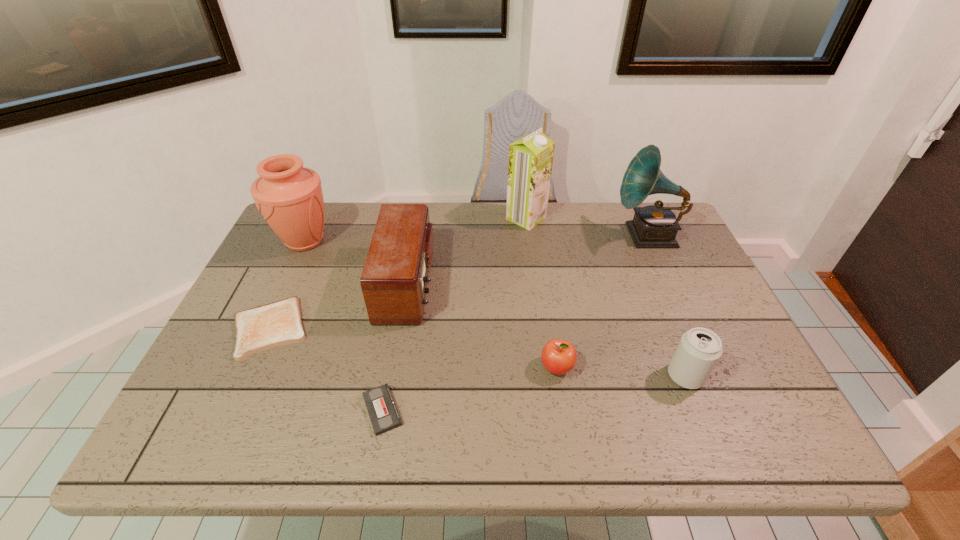
Where is `vacant space in between the toast and the videotape`? vacant space in between the toast and the videotape is located at coordinates (326, 369).

The width and height of the screenshot is (960, 540). I want to click on empty space between the can and the toast, so click(477, 352).

Identify the location of vacant area that lies between the videotape and the toast. (326, 369).

At what (x,y) coordinates should I click in order to perform the action: click on free space between the soya milk and the fourth tallest object. Please return your answer as a coordinate pair (x, y). The image size is (960, 540). Looking at the image, I should click on (467, 251).

Where is `free space between the soya milk and the fourth tallest object`? Image resolution: width=960 pixels, height=540 pixels. free space between the soya milk and the fourth tallest object is located at coordinates (467, 251).

Identify which object is the second nearest to the radio receiver. Please provide its 2D coordinates. Your answer should be formatted as a tuple, i.e. [(x, y)], where the tuple contains the x and y coordinates of a point satisfying the conditions above.

[(384, 416)]

Locate which object is the closest to the radio receiver. Please provide its 2D coordinates. Your answer should be formatted as a tuple, i.e. [(x, y)], where the tuple contains the x and y coordinates of a point satisfying the conditions above.

[(278, 323)]

This screenshot has height=540, width=960. I want to click on free point that satisfies the following two spatial constraints: 1. on the front-facing side of the fifth shortest object; 2. on the front side of the videotape, so click(385, 410).

Locate an element on the screen. This screenshot has height=540, width=960. free region that satisfies the following two spatial constraints: 1. on the front-facing side of the can; 2. on the right side of the radio receiver is located at coordinates (391, 376).

The height and width of the screenshot is (540, 960). Find the location of `free space that satisfies the following two spatial constraints: 1. on the front side of the fourth shortest object; 2. on the right side of the soya milk`. free space that satisfies the following two spatial constraints: 1. on the front side of the fourth shortest object; 2. on the right side of the soya milk is located at coordinates (546, 376).